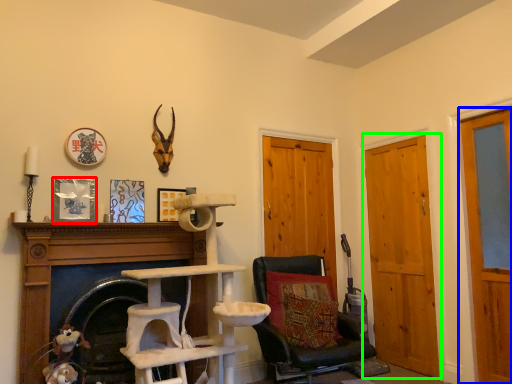
Question: Based on their relative distances, which object is nearer to picture frame (highlighted by a red box)? Choose from door (highlighted by a blue box) and door (highlighted by a green box).

Choices:
 (A) door
 (B) door

Answer: (B)